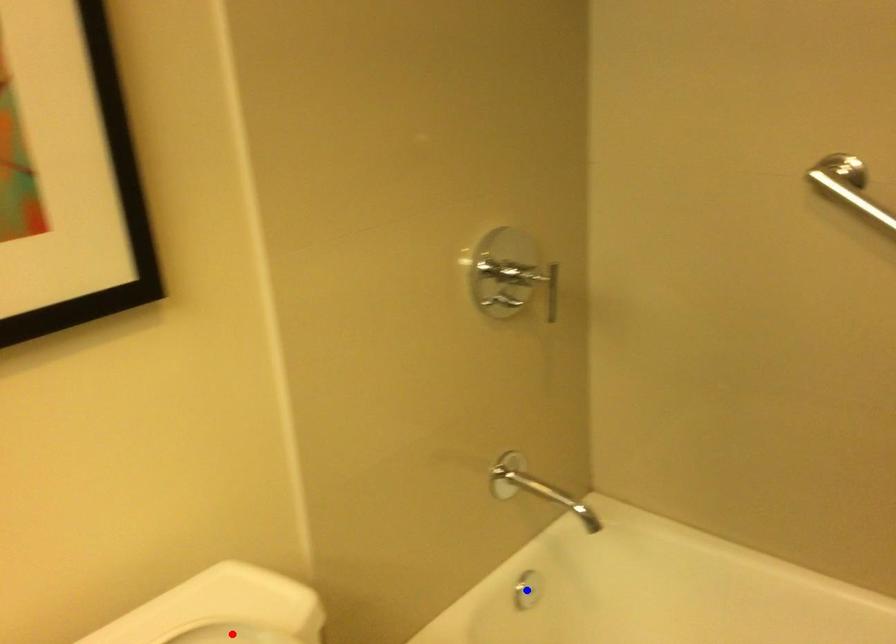
Question: Which of the two points in the image is closer to the camera?

Choices:
 (A) Blue point is closer.
 (B) Red point is closer.

Answer: (B)